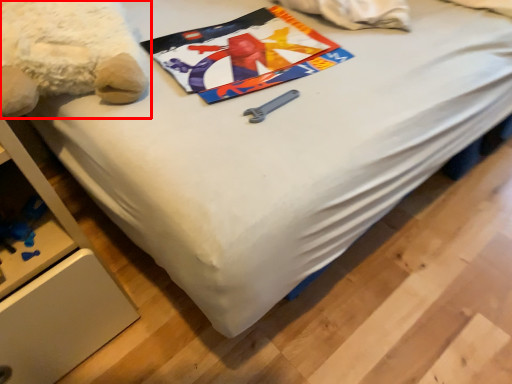
Question: From the image's perspective, where is teddy bear (annotated by the red box) located in relation to design in the image?

Choices:
 (A) above
 (B) below

Answer: (A)